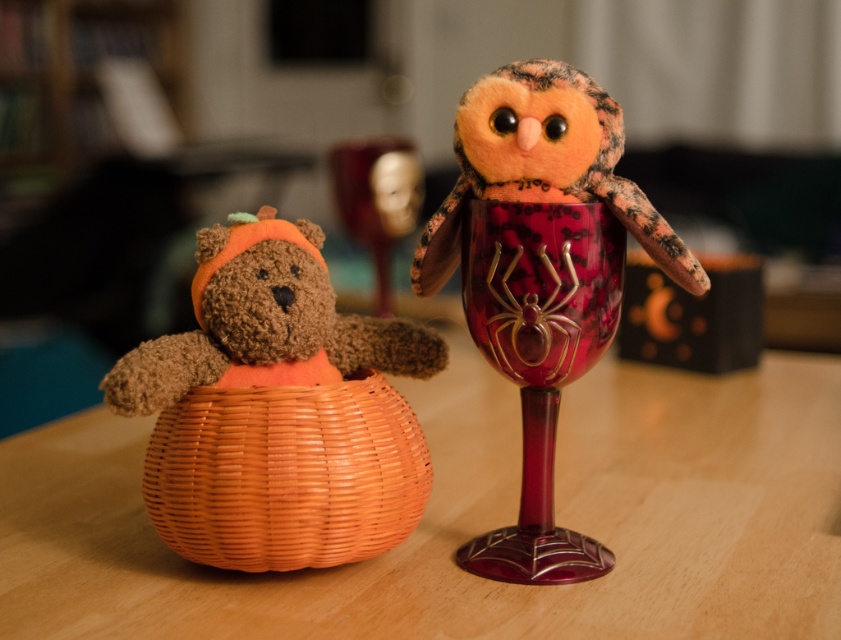
Question: Which object is the closest to the ruby glass with spider design at right?

Choices:
 (A) wooden table at center
 (B) brown fuzzy teddy bear at left
 (C) fluffy orange owl at upper right

Answer: (C)

Question: Can you confirm if ruby glass with spider design at right is positioned to the left of brown fuzzy teddy bear at left?

Choices:
 (A) yes
 (B) no

Answer: (B)

Question: Observing the image, what is the correct spatial positioning of orange wicker basket at lower left in reference to brown fuzzy teddy bear at left?

Choices:
 (A) below
 (B) above

Answer: (A)

Question: Estimate the real-world distances between objects in this image. Which object is farther from the ruby glass with spider design at right?

Choices:
 (A) brown fuzzy teddy bear at left
 (B) velvety orange owl at center

Answer: (A)

Question: Which object appears farthest from the camera in this image?

Choices:
 (A) velvety orange owl at center
 (B) fluffy orange owl at upper right
 (C) brown fuzzy teddy bear at left

Answer: (A)

Question: Does velvety orange owl at center have a smaller size compared to fluffy orange owl at upper right?

Choices:
 (A) yes
 (B) no

Answer: (B)